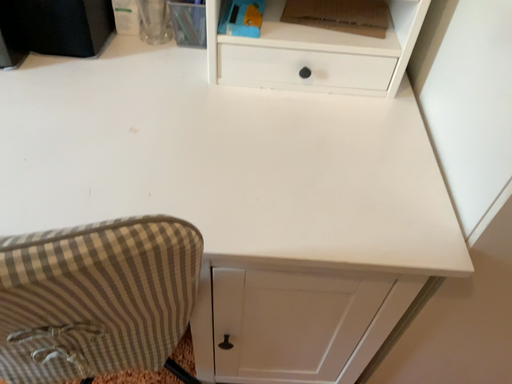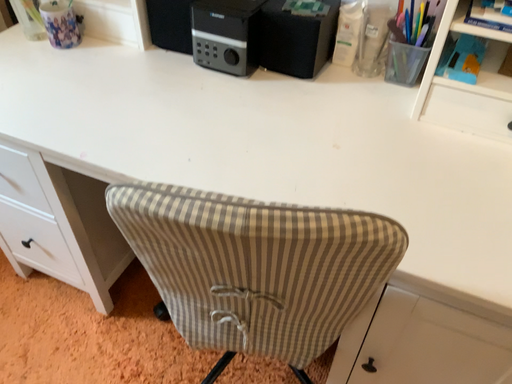
Question: How did the camera likely rotate when shooting the video?

Choices:
 (A) rotated upward
 (B) rotated downward

Answer: (A)